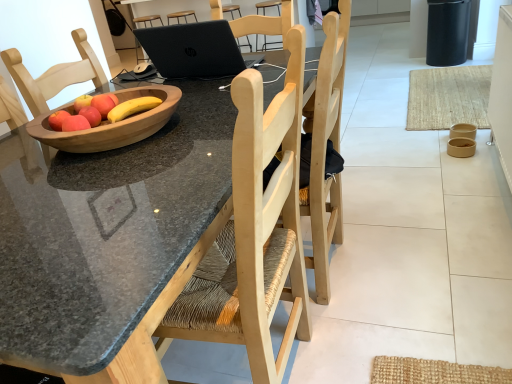
Find the location of `vacant space to the right of wooden bowl of fruit at center`. vacant space to the right of wooden bowl of fruit at center is located at coordinates (203, 117).